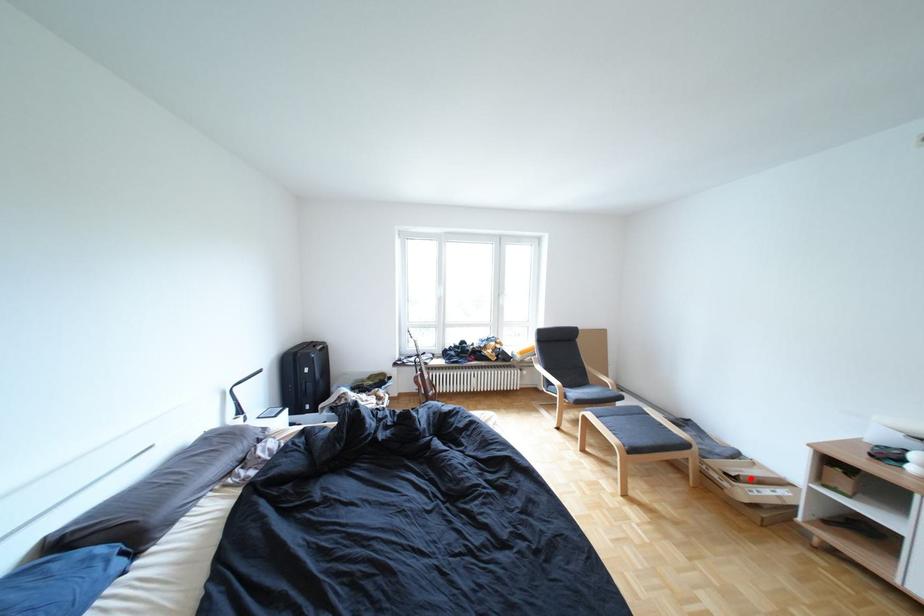
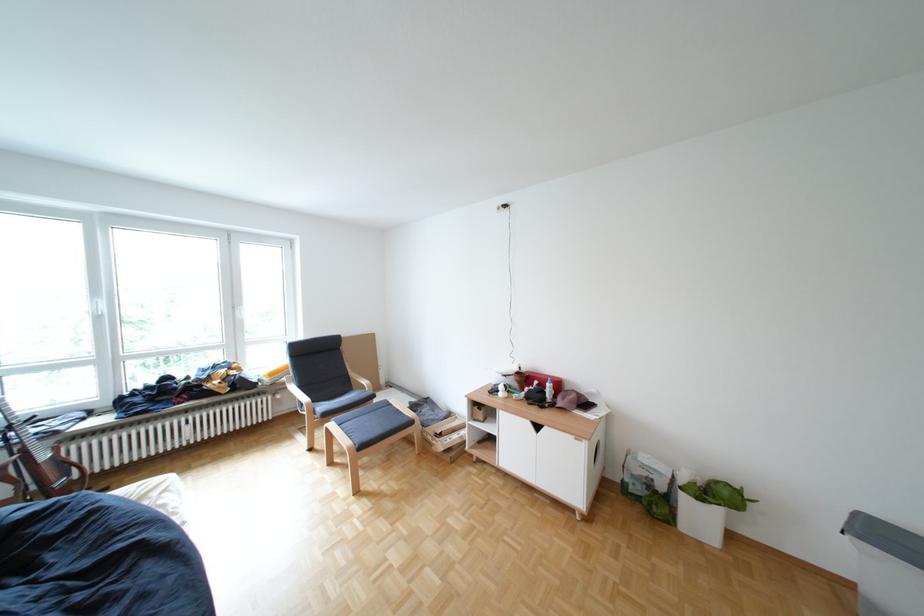
The point at the highlighted location is marked in the first image. Where is the corresponding point in the second image?

(456, 436)